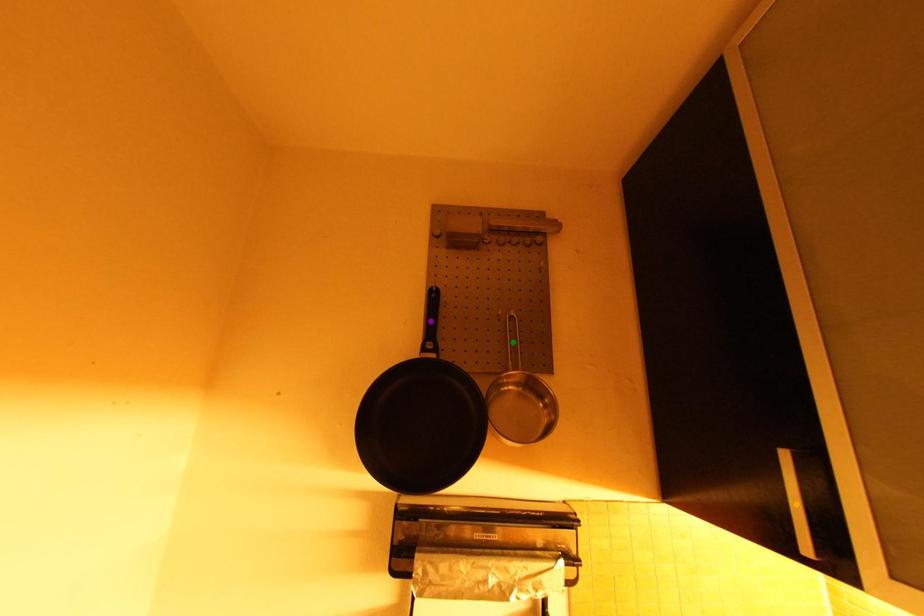
Order these from nearest to farthest:
orange point, purple point, green point

green point
purple point
orange point